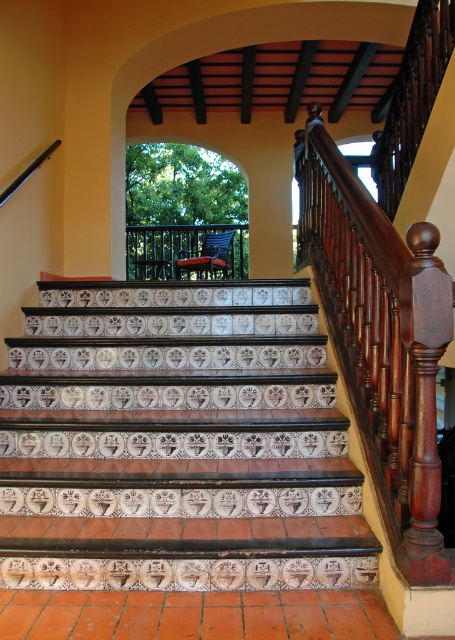
Question: Which of the following is the farthest from the observer?

Choices:
 (A) (176, 240)
 (B) (410, 582)
 (C) (65, 580)
 (D) (414, 269)

Answer: (A)

Question: Is white glossy tile at center bigger than mahogany wood newel post at right?

Choices:
 (A) no
 (B) yes

Answer: (B)

Question: Estimate the real-world distances between objects in this image. Which object is closer to the mahogany wood newel post at right?

Choices:
 (A) mahogany wood railing at upper right
 (B) wooden balustrade at center
 (C) white glossy tile at center

Answer: (A)

Question: Among these points, which one is nearest to the camera?

Choices:
 (A) (415, 445)
 (B) (153, 554)
 (C) (203, 253)

Answer: (A)

Question: Is mahogany wood newel post at right smaller than wooden balustrade at center?

Choices:
 (A) yes
 (B) no

Answer: (A)

Question: Can you confirm if mahogany wood railing at upper right is bigger than mahogany wood newel post at right?

Choices:
 (A) yes
 (B) no

Answer: (A)